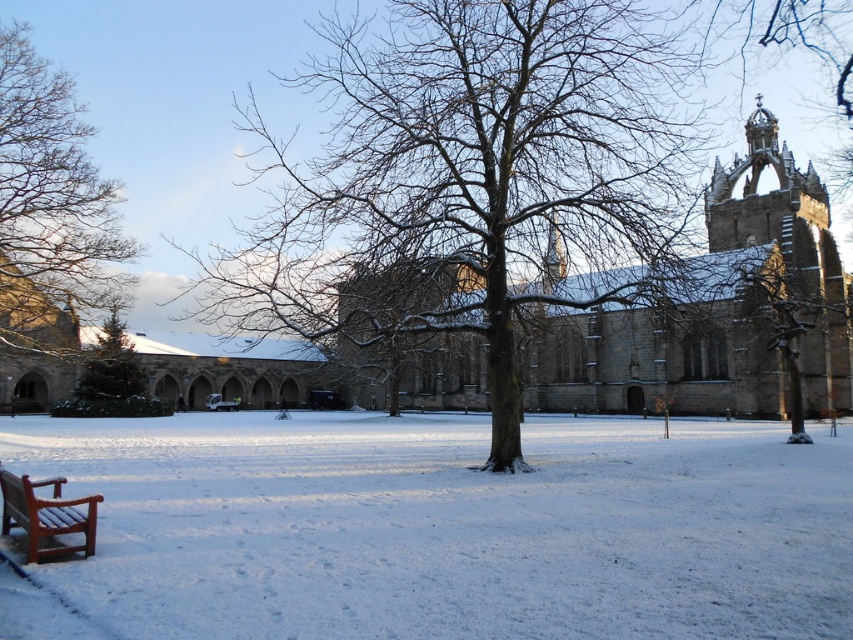
Which is above, snow-covered tree at center or green glossy pine tree at lower left?

snow-covered tree at center is above.

Is snow-covered tree at center taller than green glossy pine tree at lower left?

Yes.

The height and width of the screenshot is (640, 853). I want to click on snow-covered tree at center, so click(x=469, y=170).

This screenshot has height=640, width=853. I want to click on snow-covered tree at center, so click(x=469, y=170).

Who is more distant from viewer, (3, 504) or (106, 406)?

The point (106, 406) is more distant.

Can you confirm if wooden park bench at lower left is bigger than green glossy pine tree at lower left?

Incorrect, wooden park bench at lower left is not larger than green glossy pine tree at lower left.

Is point (3, 531) behind point (135, 380)?

That is False.

At what (x,y) coordinates should I click in order to perform the action: click on wooden park bench at lower left. Please return your answer as a coordinate pair (x, y). Image resolution: width=853 pixels, height=640 pixels. Looking at the image, I should click on (45, 515).

Who is shorter, bare wood tree at left or wooden park bench at lower left?

Standing shorter between the two is wooden park bench at lower left.

Between bare wood tree at left and wooden park bench at lower left, which one is positioned higher?

bare wood tree at left is higher up.

Which is in front, point (61, 100) or point (33, 506)?

Point (33, 506) is in front.

Where is `bare wood tree at left`? bare wood tree at left is located at coordinates (49, 209).